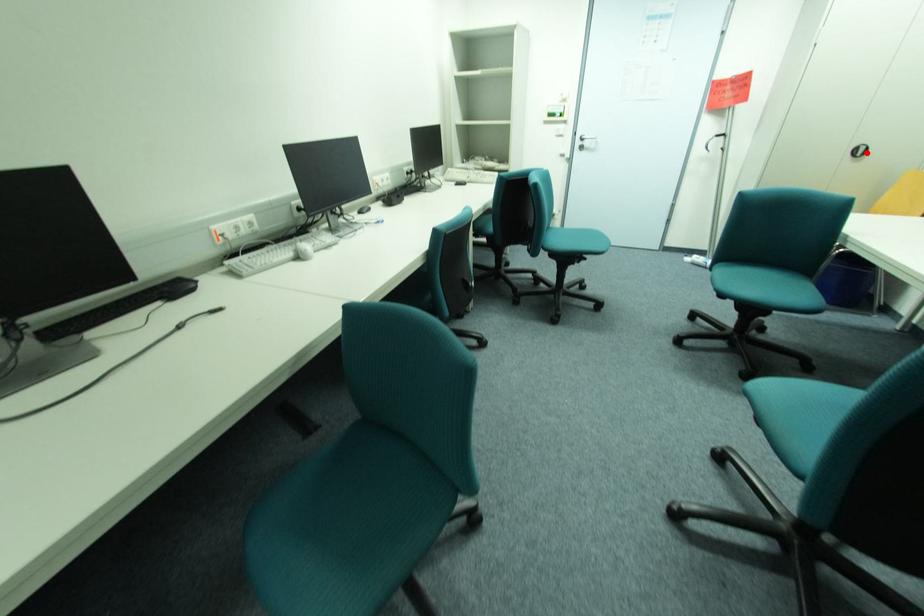
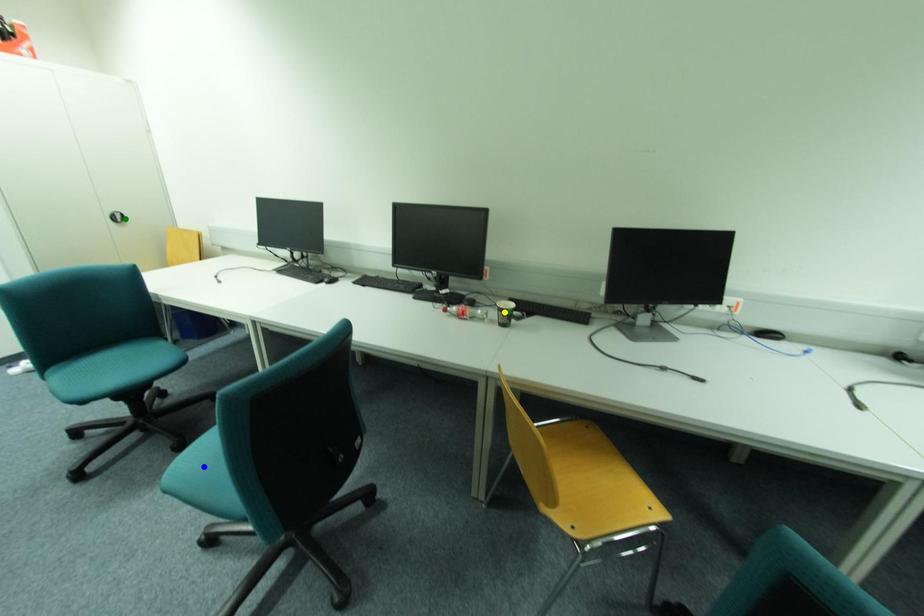
Question: I am providing you with two images of the same scene from different viewpoints. A red point is marked on the first image. You are given multiple points on the second image. Which spot in image 2 lines up with the point in image 1?

Choices:
 (A) yellow point
 (B) blue point
 (C) green point

Answer: (C)